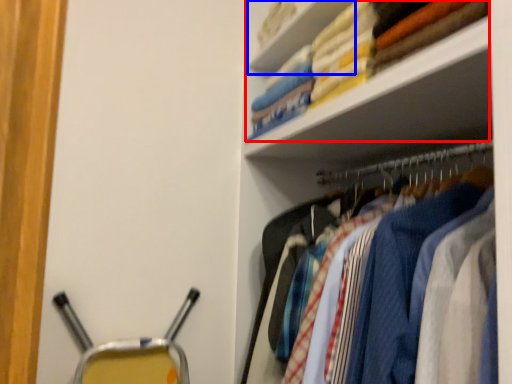
Question: Which object appears farthest to the camera in this image, laundry (highlighted by a red box) or cabinet (highlighted by a blue box)?

Choices:
 (A) laundry
 (B) cabinet

Answer: (B)